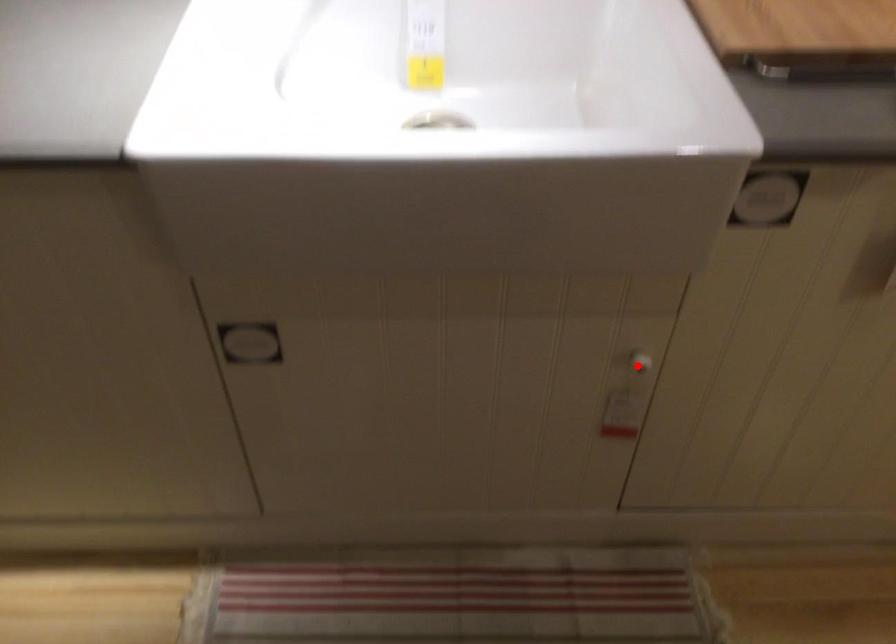
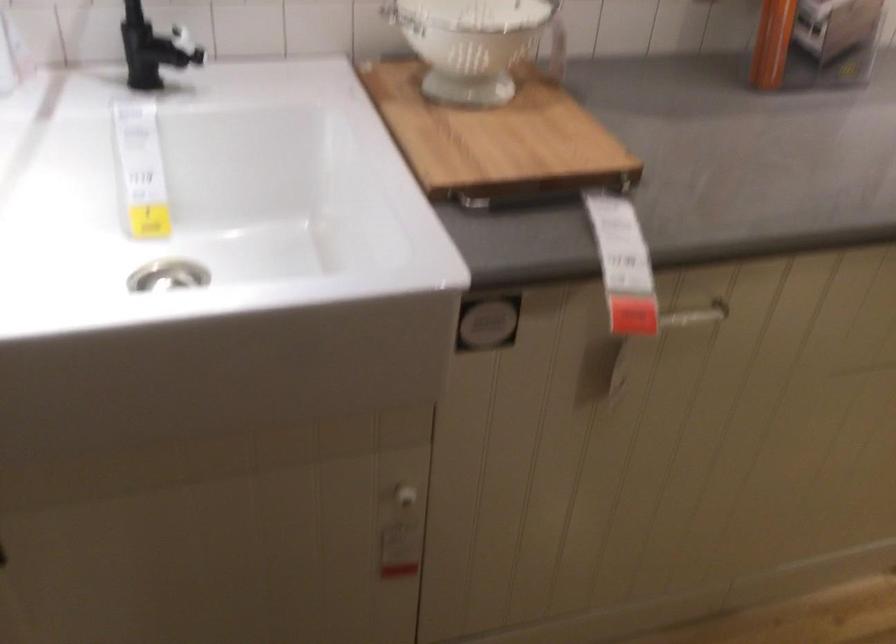
In the second image, find the point that corresponds to the highlighted location in the first image.

(403, 497)